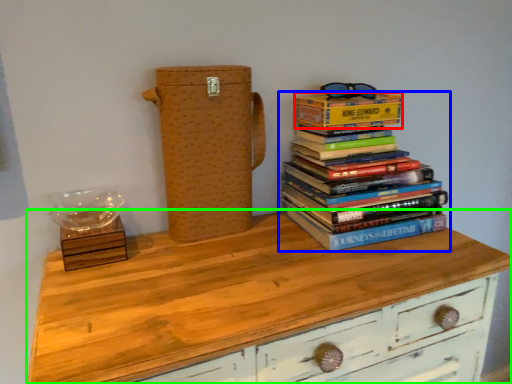
Question: Estimate the real-world distances between objects in this image. Which object is farther from paperback book (highlighted by a red box), book (highlighted by a blue box) or chest of drawers (highlighted by a green box)?

Choices:
 (A) book
 (B) chest of drawers

Answer: (B)